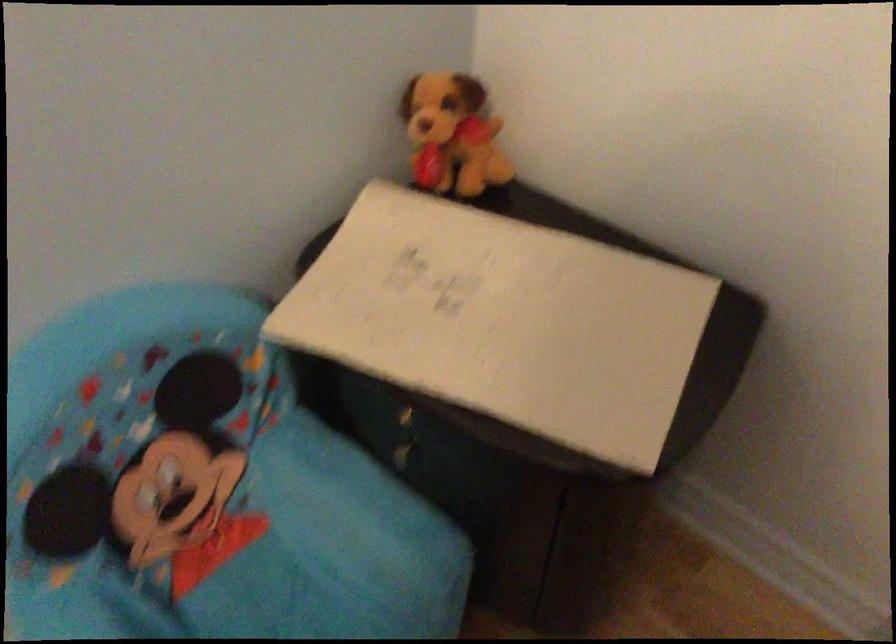
Find where to sit the blue chair sitting surface. Please return your answer as a coordinate pair (x, y).

(220, 554)